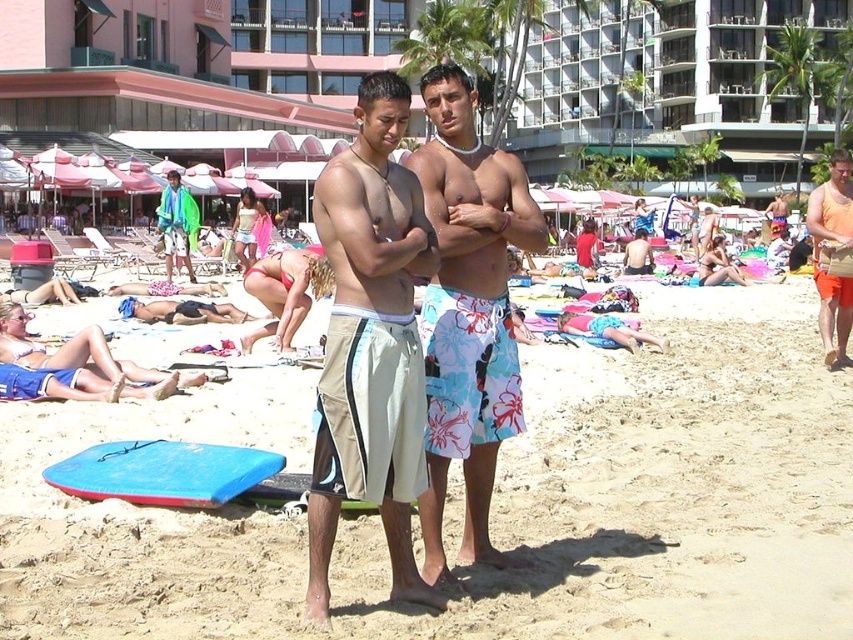
You are a photographer trying to capture the exact location of the beige cotton shorts at center in the image. According to the coordinates provided, where would you focus your camera?

The beige cotton shorts at center is located at point 0.537 on the x axis and 0.436 on the y axis.

What is located at the point with coordinates (369, 227) in the image?

The point at coordinates (369, 227) indicates floral swim trunks at center.

You are a photographer trying to capture a closeup shot of the beige cotton shorts at center and the red fabric bikini bottom at center. Based on their positions, which one would be in the foreground of the photo?

The beige cotton shorts at center is located below the red fabric bikini bottom at center, so the beige cotton shorts at center would be in the foreground since it is positioned lower in the frame.